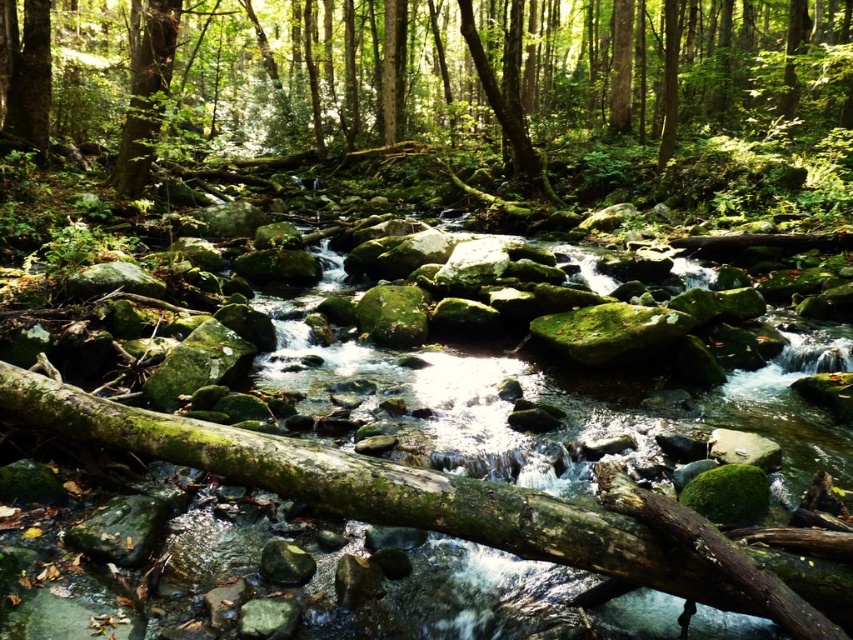
Question: Where is green mossy rock at center located in relation to green mossy rocks at center in the image?

Choices:
 (A) left
 (B) right

Answer: (A)

Question: Which point is closer to the camera taking this photo?

Choices:
 (A) (531, 385)
 (B) (76, 131)

Answer: (A)

Question: In this image, where is green mossy rock at center located relative to green mossy rocks at center?

Choices:
 (A) left
 (B) right

Answer: (A)

Question: Which point is closer to the camera taking this photo?

Choices:
 (A) pos(129,483)
 (B) pos(506,58)

Answer: (A)

Question: Does green mossy rock at center appear on the right side of green mossy rocks at center?

Choices:
 (A) yes
 (B) no

Answer: (B)

Question: Which of the following is the farthest from the observer?

Choices:
 (A) green mossy rocks at center
 (B) green mossy rock at center

Answer: (B)